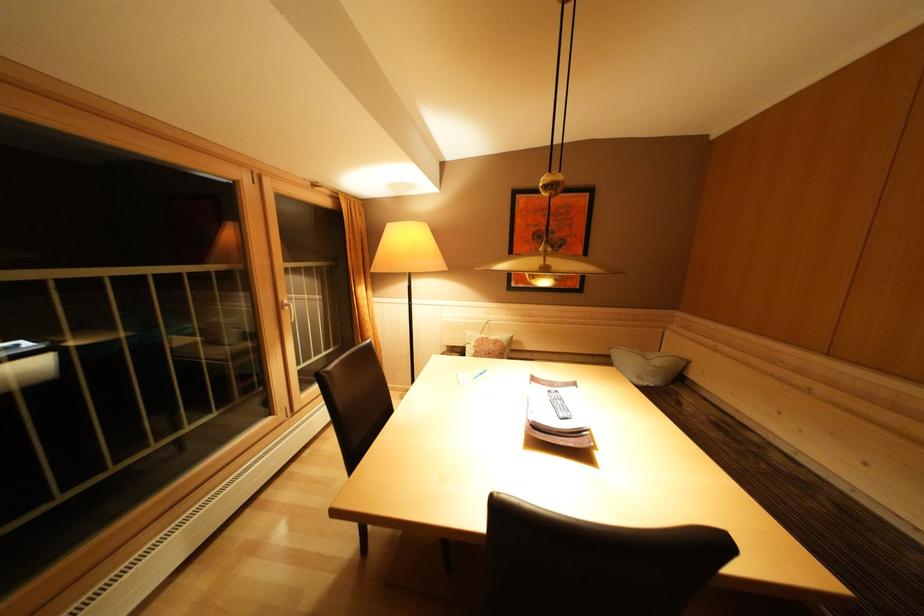
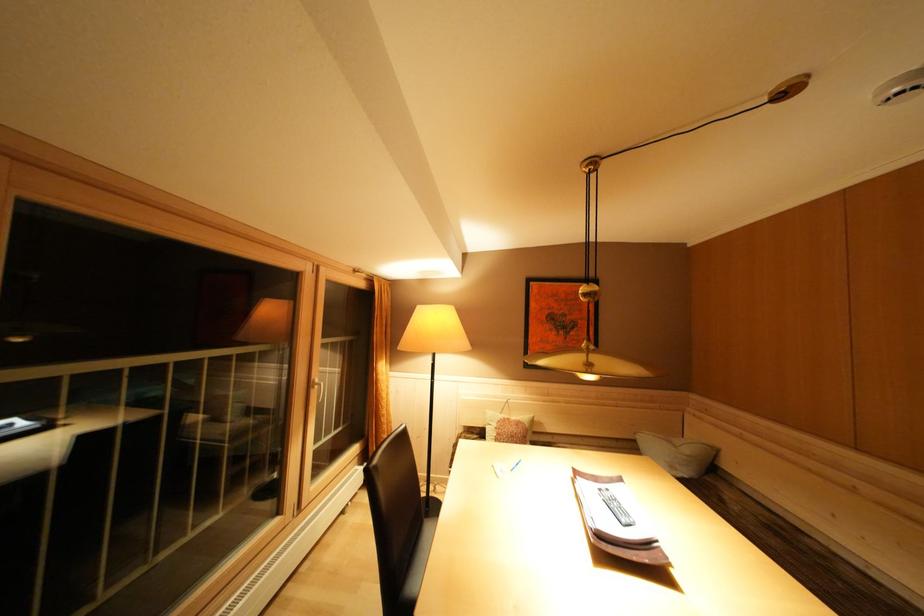
Find the pixel in the second image that matches (493,342) in the first image.

(515, 424)